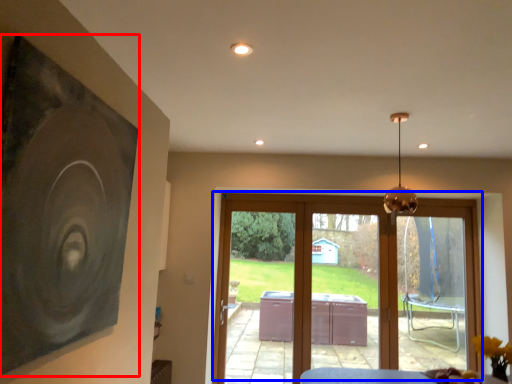
Question: Which point is further to the camera, picture frame (highlighted by a red box) or door (highlighted by a blue box)?

Choices:
 (A) picture frame
 (B) door

Answer: (B)